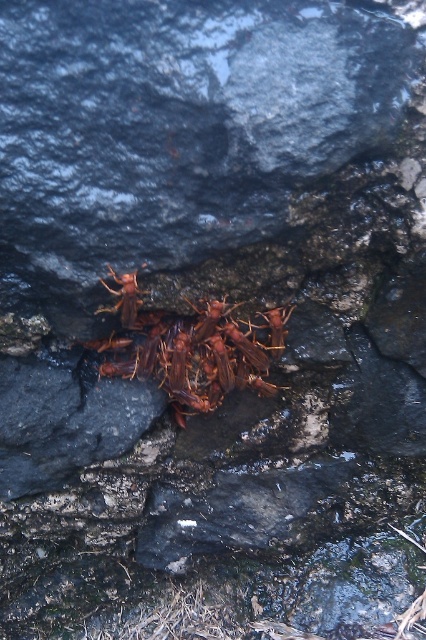
Question: Which object appears farthest from the camera in this image?

Choices:
 (A) brown matte insects at center
 (B) matte brown insect at center

Answer: (A)

Question: Which of the following is the closest to the observer?

Choices:
 (A) brown matte insects at center
 (B) matte brown insect at center

Answer: (B)

Question: In this image, where is brown matte insects at center located relative to matte brown insect at center?

Choices:
 (A) below
 (B) above

Answer: (A)

Question: From the image, what is the correct spatial relationship of brown matte insects at center in relation to matte brown insect at center?

Choices:
 (A) below
 (B) above

Answer: (A)

Question: In this image, where is brown matte insects at center located relative to matte brown insect at center?

Choices:
 (A) above
 (B) below

Answer: (B)